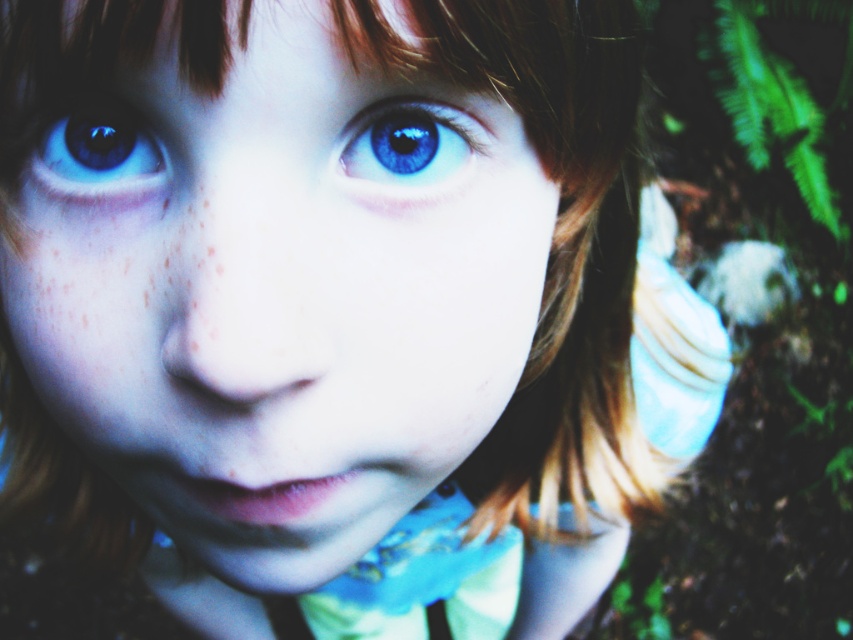
Which is behind, point (137, 96) or point (403, 122)?

The point (403, 122) is behind.

Is smooth skin face at center bigger than blue glossy eye at upper center?

Yes.

Describe the element at coordinates (277, 291) in the screenshot. I see `smooth skin face at center` at that location.

Where is `smooth skin face at center`? smooth skin face at center is located at coordinates tap(277, 291).

Is smooth skin face at center in front of blue glossy eye at upper left?

Yes.

Who is more forward, (300, 403) or (97, 195)?

Point (300, 403)

Describe the element at coordinates (277, 291) in the screenshot. I see `smooth skin face at center` at that location.

The height and width of the screenshot is (640, 853). In order to click on smooth skin face at center in this screenshot , I will do `click(277, 291)`.

Between point (360, 138) and point (149, 141), which one is positioned in front?

Point (360, 138)

Is blue glossy eye at upper center wider than blue glossy eye at upper left?

Indeed, blue glossy eye at upper center has a greater width compared to blue glossy eye at upper left.

Based on the photo, who is more distant from viewer, (x=474, y=145) or (x=93, y=106)?

Point (x=93, y=106)

Identify the location of blue glossy eye at upper center. The width and height of the screenshot is (853, 640). (409, 150).